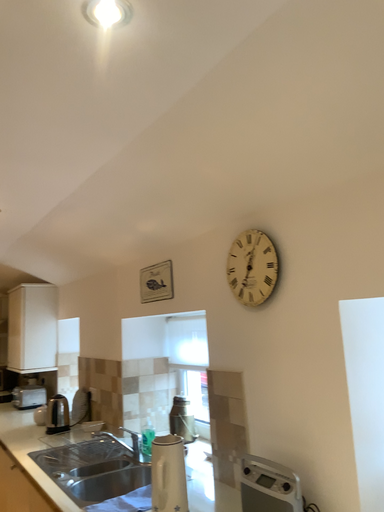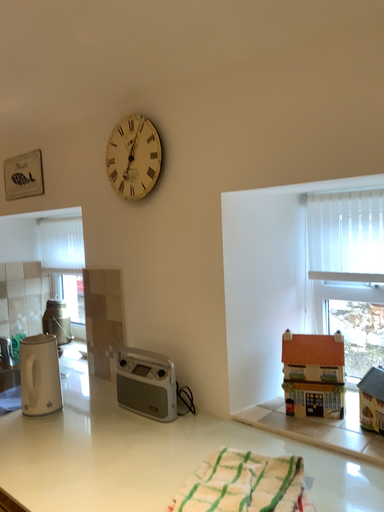
Question: How did the camera likely rotate when shooting the video?

Choices:
 (A) rotated downward
 (B) rotated upward

Answer: (A)